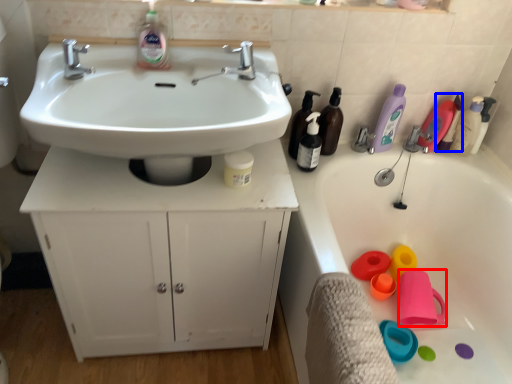
Question: Among these objects, which one is farthest to the camera, toy (highlighted by a red box) or cleaning product (highlighted by a blue box)?

Choices:
 (A) toy
 (B) cleaning product

Answer: (B)